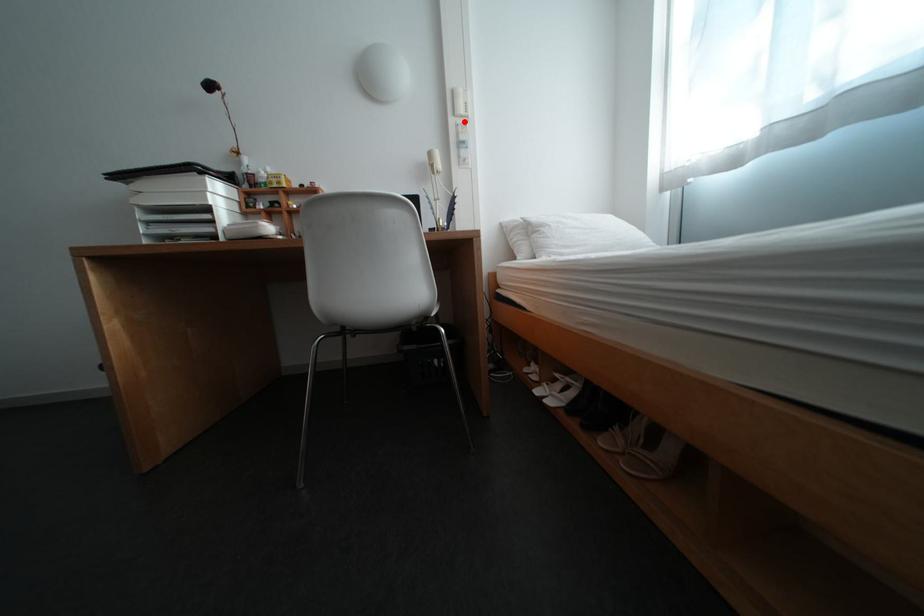
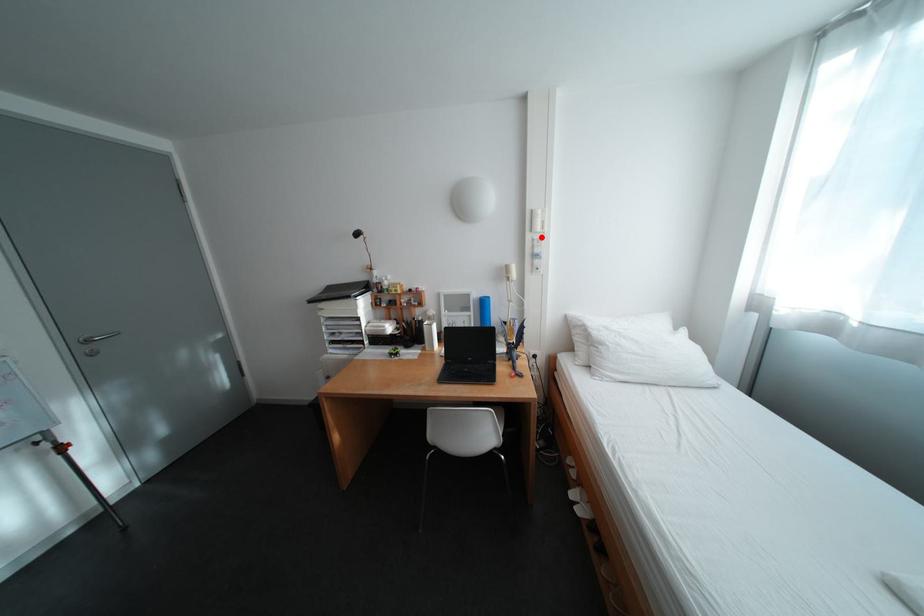
I am providing you with two images of the same scene from different viewpoints. A red point is marked on the first image and another point is marked on the second image. Do the highlighted points in image1 and image2 indicate the same real-world spot?

Yes